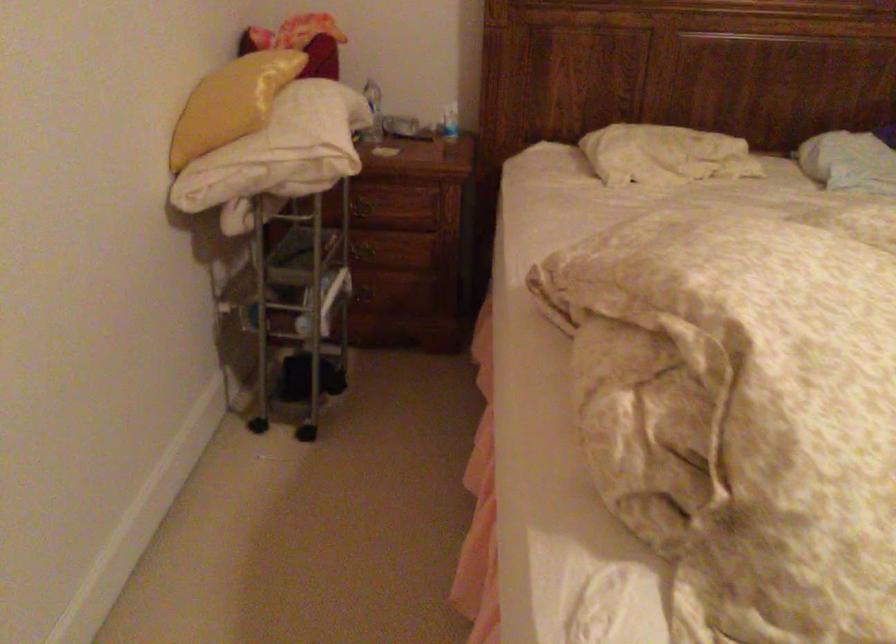
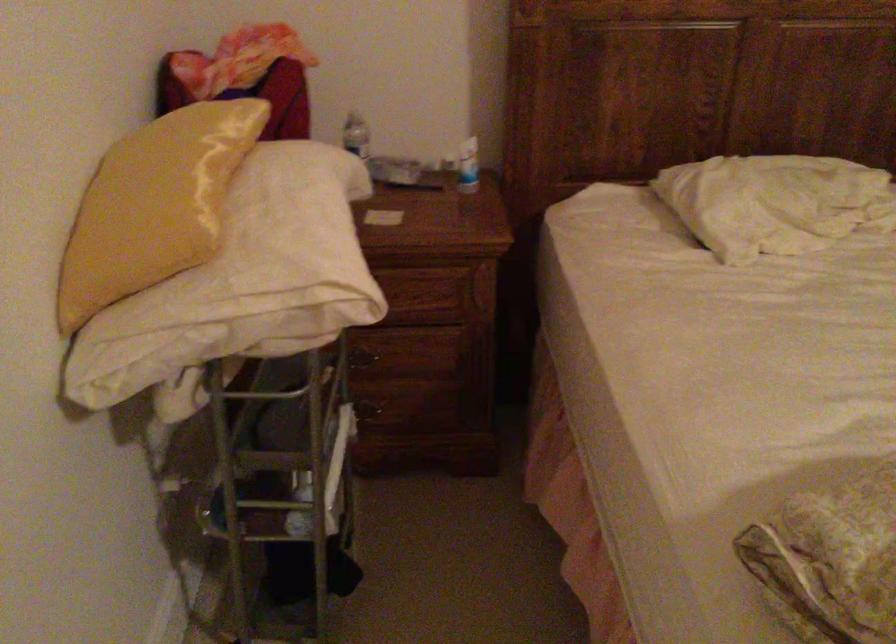
Where in the second image is the point corresponding to point (287, 138) from the first image?

(254, 272)